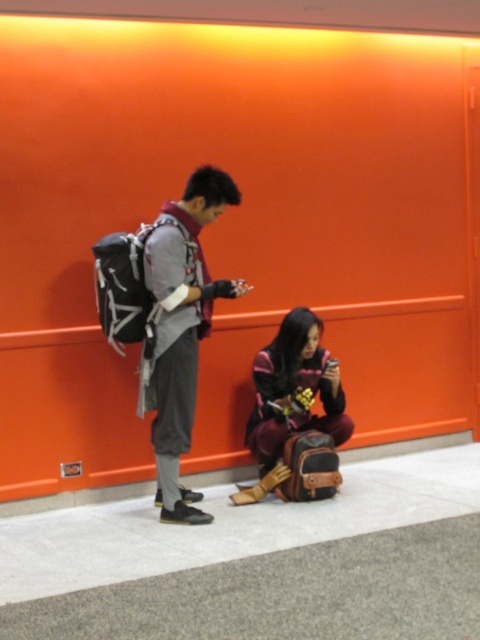
You are a security guard at the station and need to check both the matte black backpack at left and the maroon fabric bag at lower center. Which bag should you check first based on their positions?

The matte black backpack at left is positioned over the maroon fabric bag at lower center, so you should check the maroon fabric bag at lower center first as it is underneath and might be harder to access later.

You are a security guard at this station and need to check the items. Which object, the matte black backpack at left or the maroon fabric bag at lower center, is taller?

The matte black backpack at left is taller than the maroon fabric bag at lower center according to the description.

You are a security guard at the station and need to check both the matte black backpack at left and the maroon fabric bag at lower center. Which one requires more space to inspect due to its size?

The matte black backpack at left requires more space to inspect because it is bigger than the maroon fabric bag at lower center.